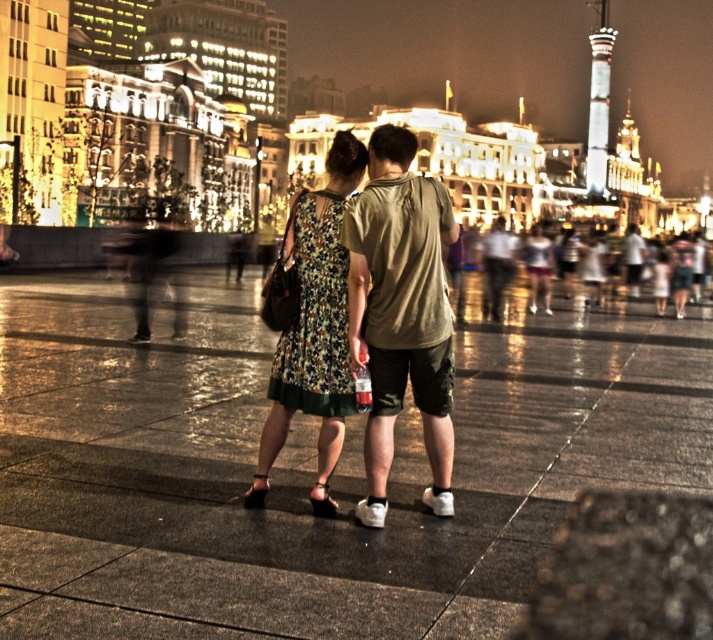
What are the coordinates of `matte khaki t-shirt at center` in the screenshot? It's located at (400, 314).

Between matte khaki t-shirt at center and floral fabric dress at center, which one is positioned lower?

floral fabric dress at center is lower down.

Identify the location of matte khaki t-shirt at center. (400, 314).

This screenshot has height=640, width=713. In order to click on matte khaki t-shirt at center in this screenshot , I will do `click(400, 314)`.